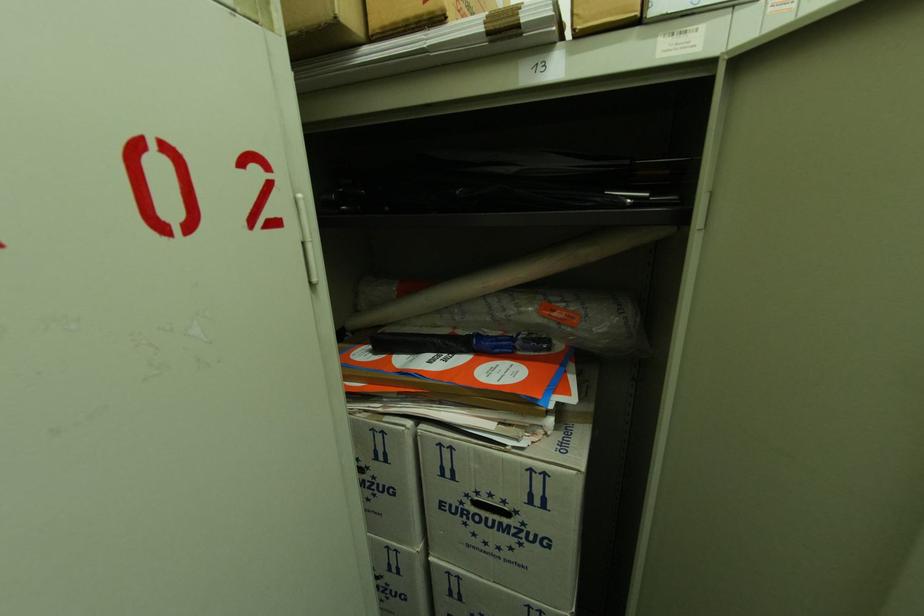
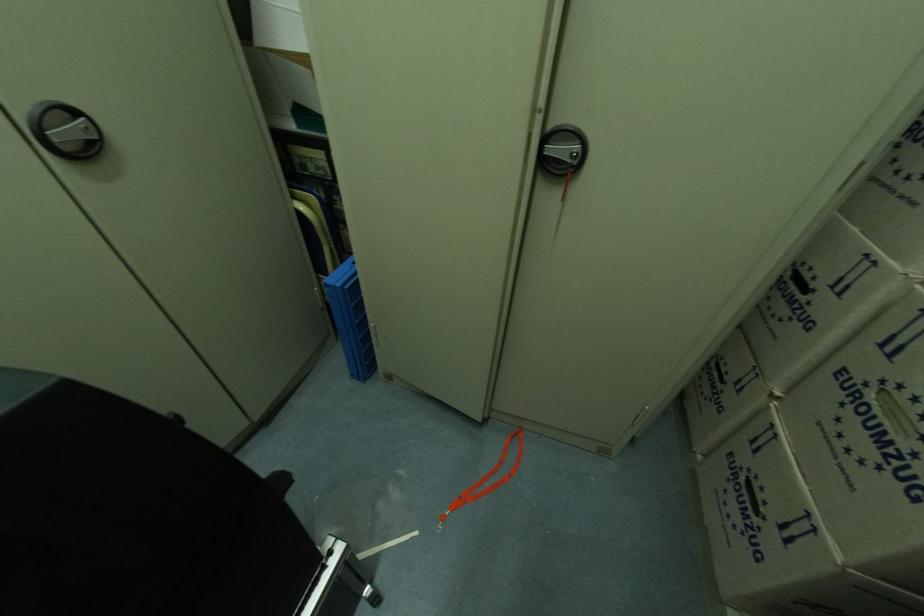
The images are taken continuously from a first-person perspective. In which direction is your viewpoint rotating?

The camera's rotation is toward left-down.